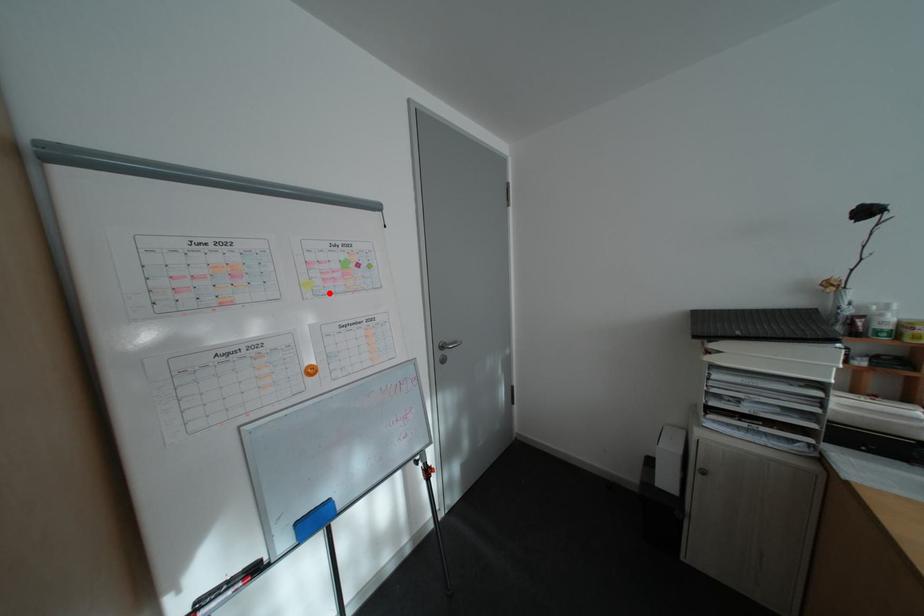
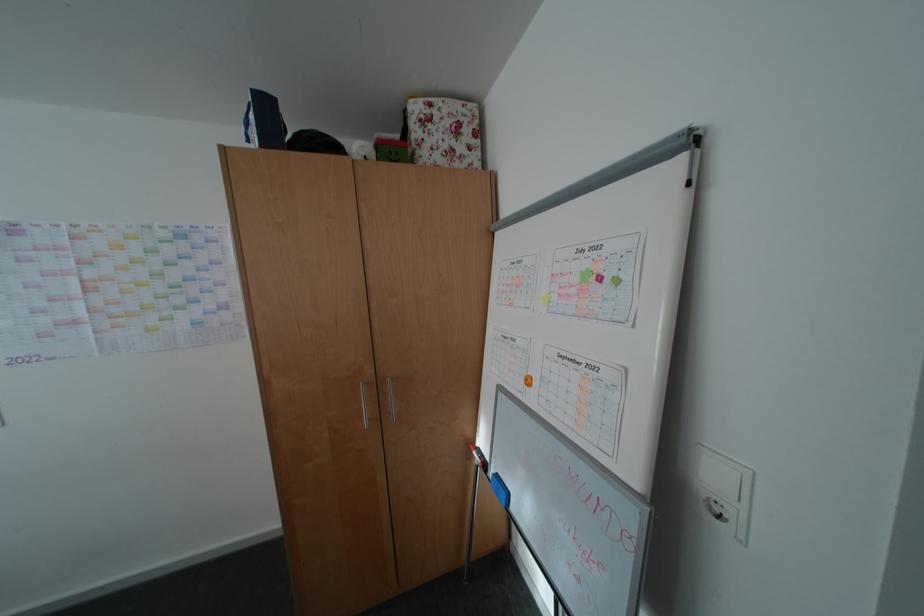
Where in the second image is the point corresponding to the highlighted location from the first image?

(563, 309)